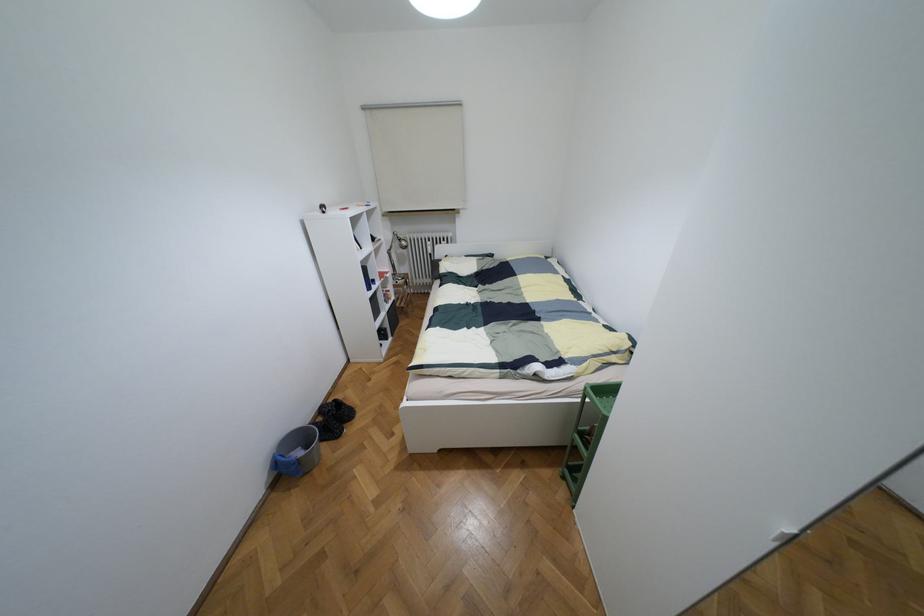
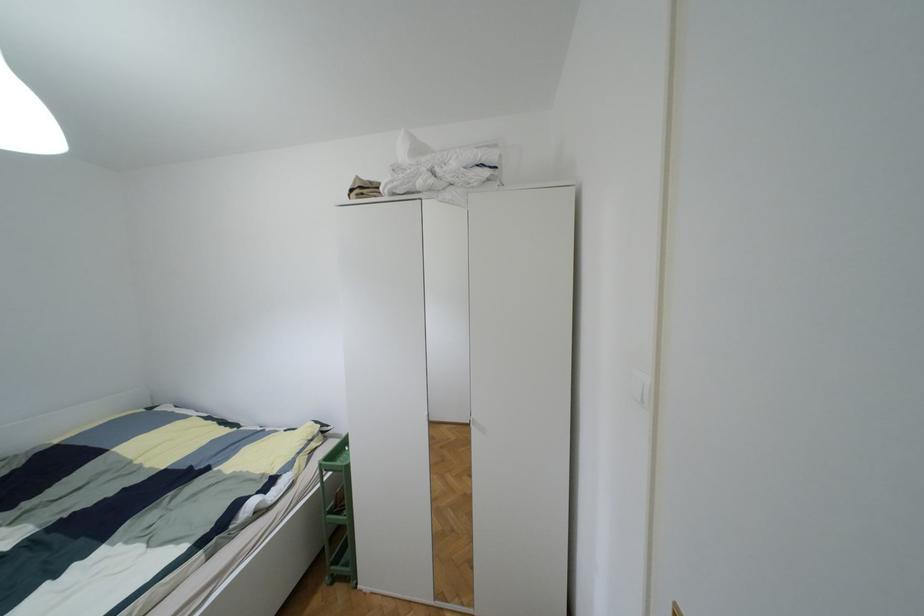
Question: The camera is either moving clockwise (left) or counter-clockwise (right) around the object. The first image is from the beginning of the video and the second image is from the end. Is the camera moving left or right when shooting the video?

Choices:
 (A) Left
 (B) Right

Answer: (A)